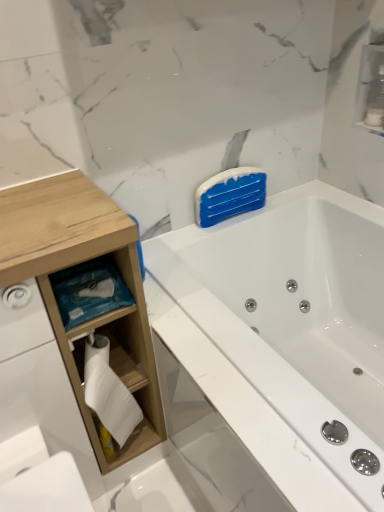
Question: Is white wood toilet paper holder at left, the 1th cabinet in the bottom-to-top sequence, a part of wooden cabinet at left?

Choices:
 (A) yes
 (B) no

Answer: (A)

Question: Considering the relative sizes of wooden cabinet at left and white wood toilet paper holder at left, the 1th cabinet in the bottom-to-top sequence, in the image provided, is wooden cabinet at left smaller than white wood toilet paper holder at left, the 1th cabinet in the bottom-to-top sequence,?

Choices:
 (A) yes
 (B) no

Answer: (B)

Question: Is wooden cabinet at left positioned with its back to white wood toilet paper holder at left, the 2th cabinet from the right?

Choices:
 (A) yes
 (B) no

Answer: (A)

Question: Does wooden cabinet at left have a lesser width compared to white wood toilet paper holder at left, the 1th cabinet in the bottom-to-top sequence?

Choices:
 (A) yes
 (B) no

Answer: (B)

Question: From a real-world perspective, is wooden cabinet at left over white wood toilet paper holder at left, the 2th cabinet in the top-to-bottom sequence?

Choices:
 (A) yes
 (B) no

Answer: (A)

Question: Considering the relative sizes of wooden cabinet at left and white wood toilet paper holder at left, the 2th cabinet from the right, in the image provided, is wooden cabinet at left wider than white wood toilet paper holder at left, the 2th cabinet from the right,?

Choices:
 (A) no
 (B) yes

Answer: (B)

Question: Is white glossy cabinet at upper right, which is counted as the first cabinet, starting from the top, wider than wooden cabinet at left?

Choices:
 (A) no
 (B) yes

Answer: (A)

Question: Is white glossy cabinet at upper right, which is the 1th cabinet from right to left, smaller than wooden cabinet at left?

Choices:
 (A) yes
 (B) no

Answer: (A)

Question: Can you confirm if white glossy cabinet at upper right, which is counted as the first cabinet, starting from the top, is shorter than wooden cabinet at left?

Choices:
 (A) no
 (B) yes

Answer: (B)

Question: Can you confirm if white glossy cabinet at upper right, which is counted as the first cabinet, starting from the top, is positioned to the right of wooden cabinet at left?

Choices:
 (A) yes
 (B) no

Answer: (A)

Question: Is white glossy cabinet at upper right, which is the second cabinet in left-to-right order, taller than wooden cabinet at left?

Choices:
 (A) no
 (B) yes

Answer: (A)

Question: From the image's perspective, does white glossy cabinet at upper right, which is the 2th cabinet from bottom to top, appear lower than wooden cabinet at left?

Choices:
 (A) yes
 (B) no

Answer: (B)

Question: Considering the relative positions of wooden cabinet at left and white glossy bathtub at upper right in the image provided, is wooden cabinet at left to the left of white glossy bathtub at upper right from the viewer's perspective?

Choices:
 (A) yes
 (B) no

Answer: (A)